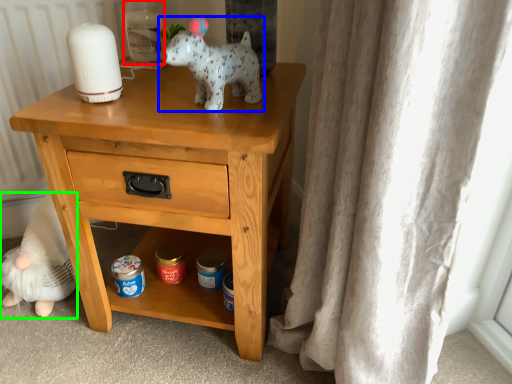
Question: Which is farther away from bottle (highlighted by a red box)? toy (highlighted by a blue box) or figurine (highlighted by a green box)?

Choices:
 (A) toy
 (B) figurine

Answer: (B)